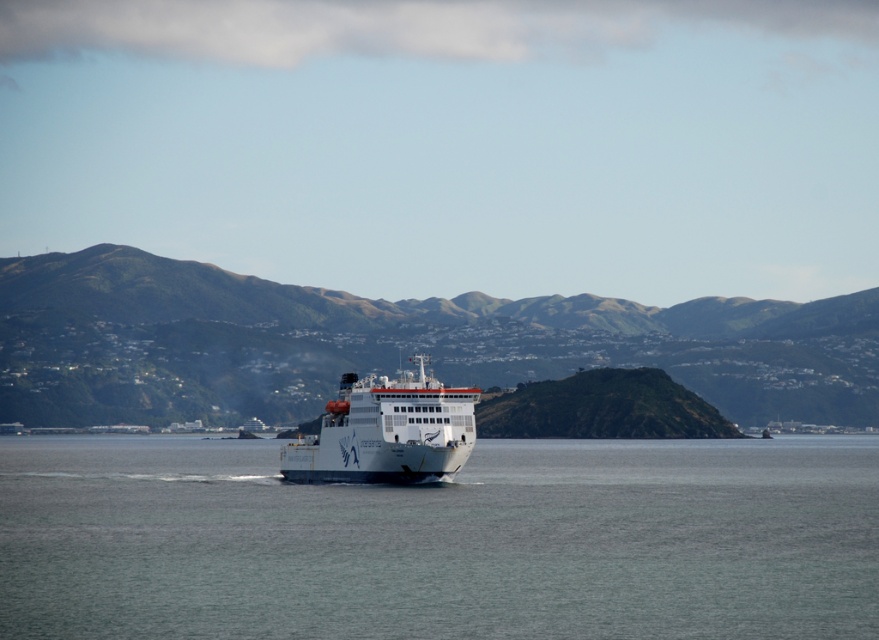
Question: Among these points, which one is nearest to the camera?

Choices:
 (A) (694, 577)
 (B) (465, 429)

Answer: (A)

Question: Which point appears closest to the camera in this image?

Choices:
 (A) coord(180,285)
 (B) coord(281,449)

Answer: (B)

Question: Which object appears farthest from the camera in this image?

Choices:
 (A) green grassy hill at center
 (B) white glossy ship at center

Answer: (A)

Question: Can you confirm if clear water at center is smaller than white glossy ship at center?

Choices:
 (A) no
 (B) yes

Answer: (A)

Question: Does clear water at center have a larger size compared to green grassy hill at center?

Choices:
 (A) no
 (B) yes

Answer: (A)

Question: Is green grassy hill at center above white glossy ship at center?

Choices:
 (A) yes
 (B) no

Answer: (B)